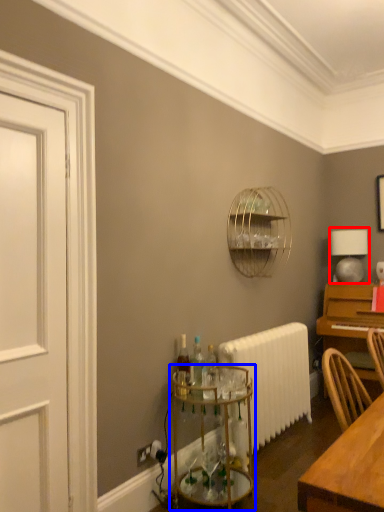
Question: Which of the following is the farthest to the observer, table lamp (highlighted by a red box) or glass table (highlighted by a blue box)?

Choices:
 (A) table lamp
 (B) glass table

Answer: (A)